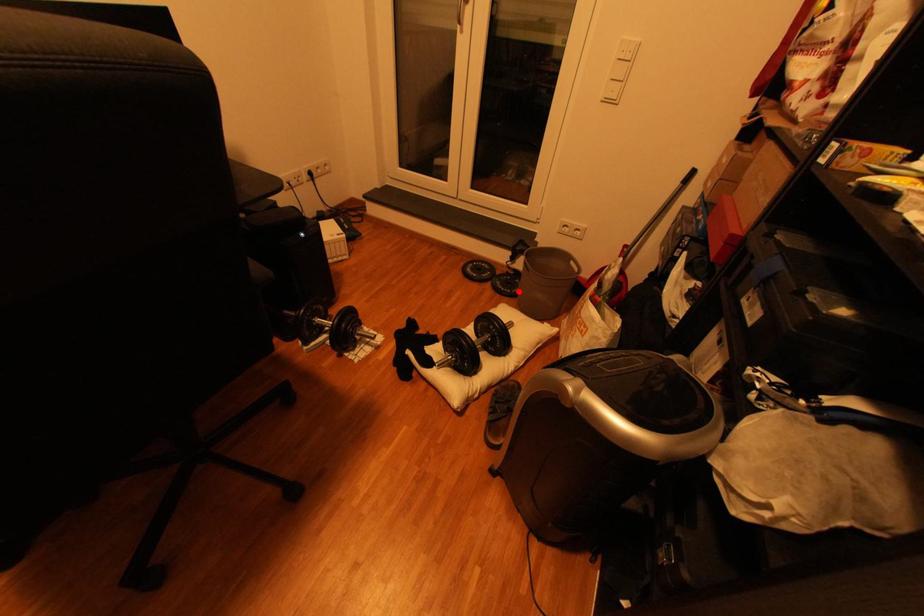
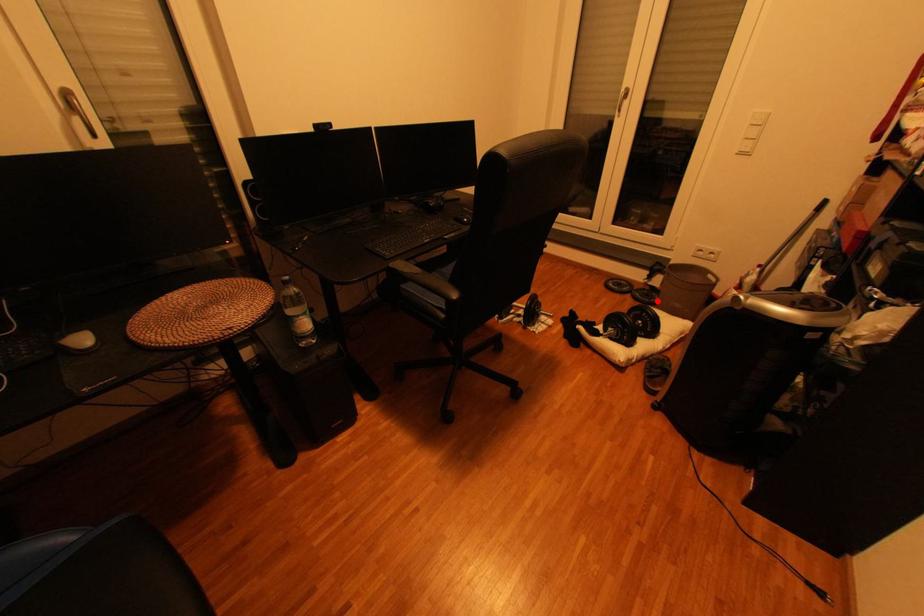
I am providing you with two images of the same scene from different viewpoints. A red point is marked on the first image and another point is marked on the second image. Are the points marked in image1 and image2 representing the same 3D position?

Yes